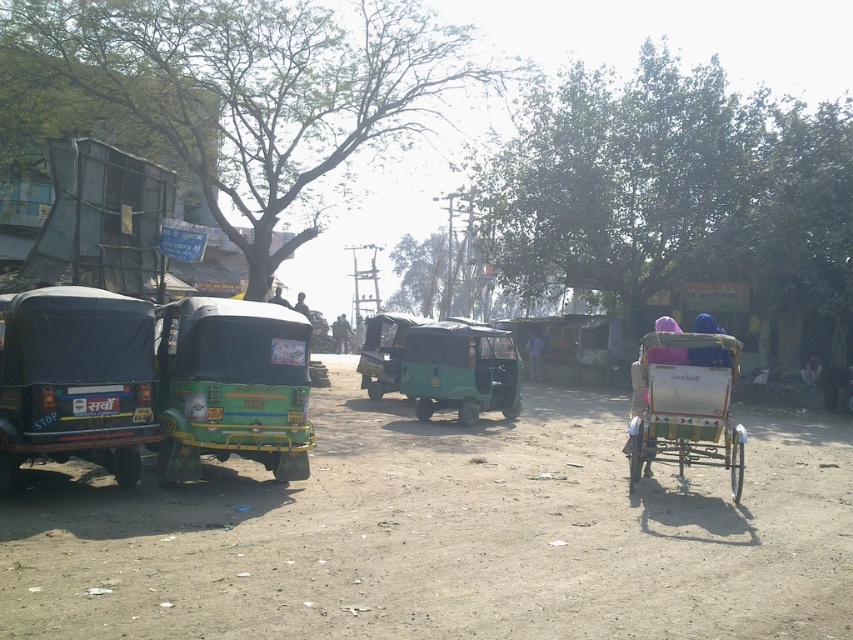
What is the 2D coordinate of the metallic silver rickshaw at center?

The metallic silver rickshaw at center is located at the 2D coordinate point of (683, 406).

You are a tourist standing on the street and see the white fabric person at center and the light brown wooden cart at center. Which one appears bigger to you?

The light brown wooden cart at center appears bigger than the white fabric person at center because the white fabric person at center has a smaller size compared to light brown wooden cart at center.